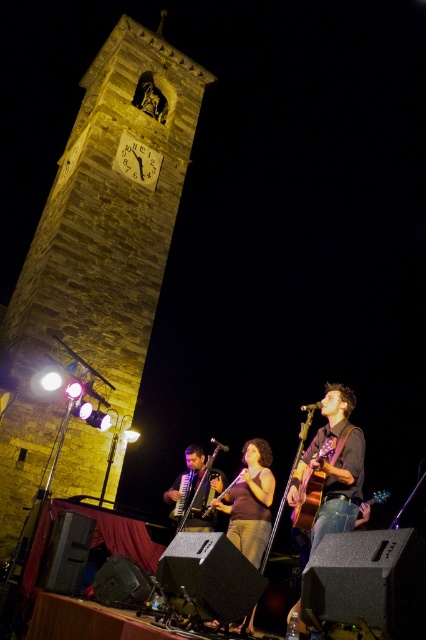
Can you confirm if matte brown accordion at lower center is taller than wooden acoustic guitar at center?

Correct, matte brown accordion at lower center is much taller as wooden acoustic guitar at center.

Can you confirm if matte brown accordion at lower center is bigger than wooden acoustic guitar at center?

Yes.

Which is in front, point (195, 470) or point (298, 465)?

Point (298, 465) is in front.

At what (x,y) coordinates should I click in order to perform the action: click on matte brown accordion at lower center. Please return your answer as a coordinate pair (x, y). This screenshot has width=426, height=640. Looking at the image, I should click on (195, 490).

Can you confirm if denim jeans at center is bigger than wooden acoustic guitar at center?

Yes, denim jeans at center is bigger than wooden acoustic guitar at center.

Which is behind, point (339, 474) or point (307, 490)?

Point (307, 490)

You are a GUI agent. You are given a task and a screenshot of the screen. Output one action in this format:
    pyautogui.click(x=<x>, y=<y>)
    Task: Click on the denim jeans at center
    
    Given the screenshot: What is the action you would take?
    pyautogui.click(x=333, y=465)

Find the location of a particular element. Image resolution: width=426 pixels, height=640 pixels. denim jeans at center is located at coordinates (333, 465).

How far apart are stone clock tower at upper left and brown fabric dress at center?

stone clock tower at upper left and brown fabric dress at center are 27.80 meters apart.

Is stone clock tower at upper left positioned at the back of brown fabric dress at center?

Yes, stone clock tower at upper left is behind brown fabric dress at center.

Measure the distance between point (176, 49) and camera.

Point (176, 49) and camera are 80.74 meters apart.

At what (x,y) coordinates should I click in order to perform the action: click on stone clock tower at upper left. Please return your answer as a coordinate pair (x, y). Looking at the image, I should click on (97, 266).